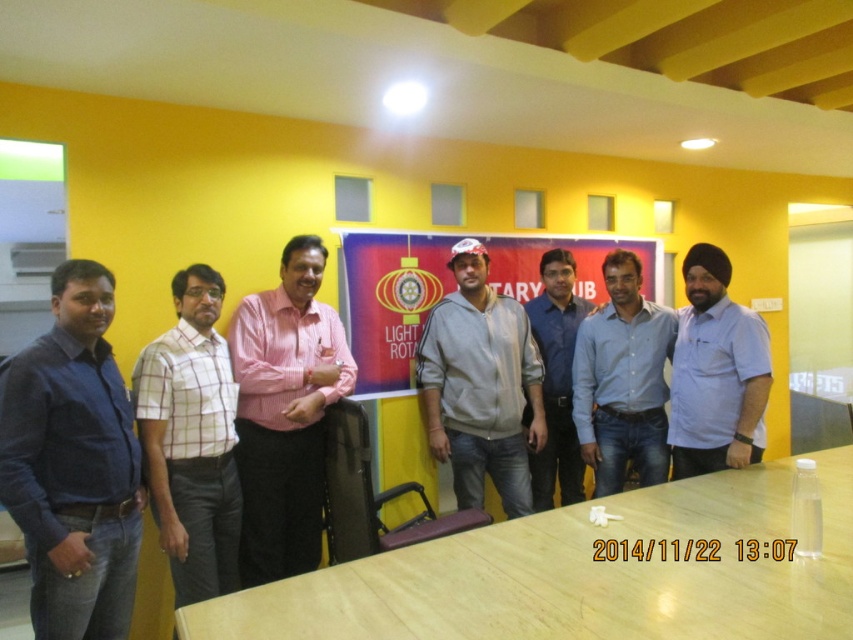
Does point (9, 400) lie in front of point (178, 339)?

That is True.

In the scene shown: Who is positioned more to the left, blue shirt at left or white checkered shirt at center?

blue shirt at left

Which is behind, point (0, 419) or point (165, 456)?

The point (165, 456) is behind.

Image resolution: width=853 pixels, height=640 pixels. I want to click on blue shirt at left, so click(73, 464).

Is point (308, 324) farther from viewer compared to point (660, 406)?

That is False.

From the picture: Which is more to the left, pink shirt at center or blue denim jeans at center?

pink shirt at center

Measure the distance between point [322,252] and camera.

A distance of 9.57 feet exists between point [322,252] and camera.

Identify the location of pink shirt at center. (285, 412).

Between light wood table at center and matte plastic banner at center, which one has more height?

matte plastic banner at center

Is light wood table at center behind matte plastic banner at center?

No.

Which is behind, point (727, 481) or point (641, 237)?

Positioned behind is point (641, 237).

Image resolution: width=853 pixels, height=640 pixels. In order to click on light wood table at center in this screenshot , I will do `click(582, 573)`.